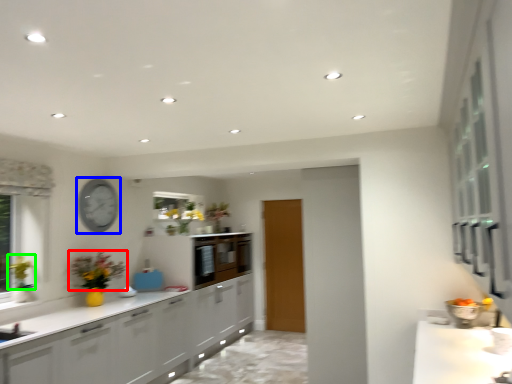
Question: Estimate the real-world distances between objects in this image. Which object is farther from flower (highlighted by a red box), clock (highlighted by a blue box) or floral arrangement (highlighted by a green box)?

Choices:
 (A) clock
 (B) floral arrangement

Answer: (B)